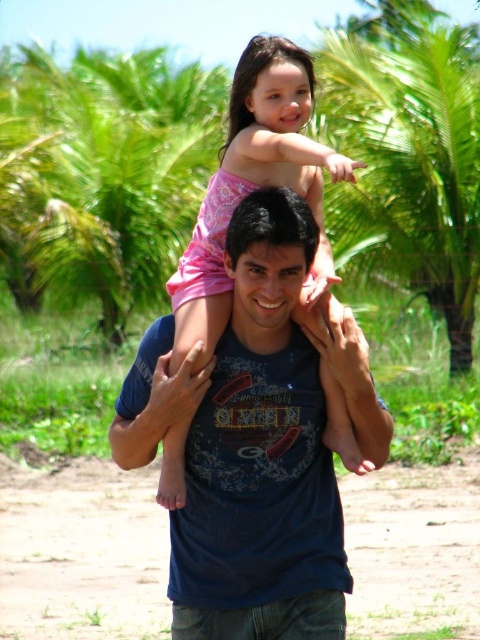
Question: Is brown dirt track at center bigger than green leafy palm tree at upper left?

Choices:
 (A) no
 (B) yes

Answer: (A)

Question: Which of the following is the closest to the observer?

Choices:
 (A) (463, 248)
 (B) (35, 548)

Answer: (B)

Question: Which point is closer to the camera?

Choices:
 (A) (191, 337)
 (B) (152, 413)

Answer: (A)

Question: Does brown dirt track at center have a lesser width compared to pink cotton shirt at center?

Choices:
 (A) no
 (B) yes

Answer: (A)

Question: Among these objects, which one is farthest from the camera?

Choices:
 (A) brown dirt track at center
 (B) pink cotton shirt at center

Answer: (A)

Question: Observing the image, what is the correct spatial positioning of blue cotton shirt at center in reference to brown dirt track at center?

Choices:
 (A) above
 (B) below

Answer: (A)